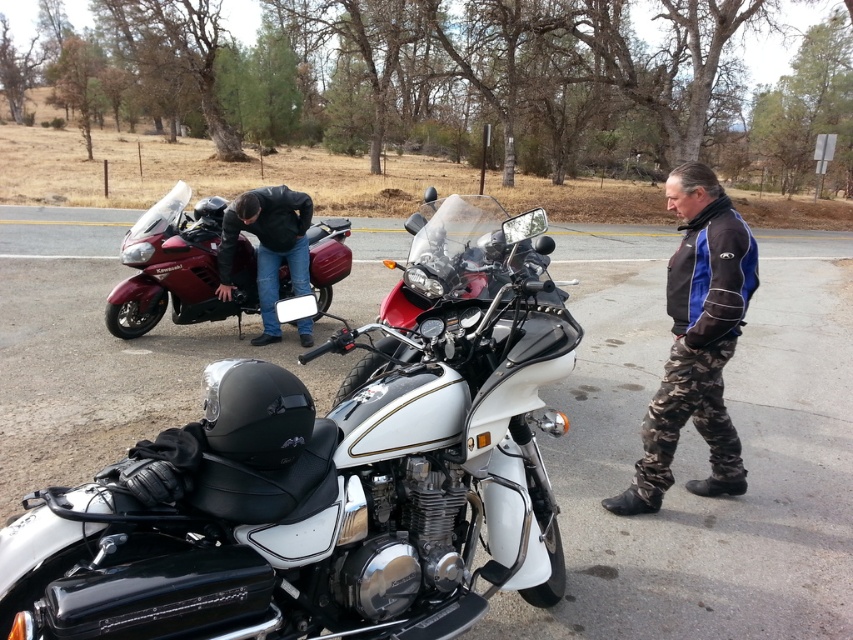
Question: Is camouflage pants at right further to the viewer compared to shiny maroon motorcycle at left?

Choices:
 (A) no
 (B) yes

Answer: (A)

Question: Is shiny maroon motorcycle at left positioned at the back of dark blue leather jacket at left?

Choices:
 (A) yes
 (B) no

Answer: (A)

Question: Which object appears farthest from the camera in this image?

Choices:
 (A) shiny metallic motorcycle at center
 (B) camouflage pants at right
 (C) shiny maroon motorcycle at left
 (D) dark blue leather jacket at left

Answer: (C)

Question: Which object is the farthest from the shiny maroon motorcycle at left?

Choices:
 (A) shiny metallic motorcycle at center
 (B) camouflage pants at right

Answer: (B)

Question: Does shiny maroon motorcycle at left have a greater width compared to dark blue leather jacket at left?

Choices:
 (A) yes
 (B) no

Answer: (A)

Question: Which point is closer to the camera taking this photo?

Choices:
 (A) (437, 531)
 (B) (699, 394)

Answer: (A)